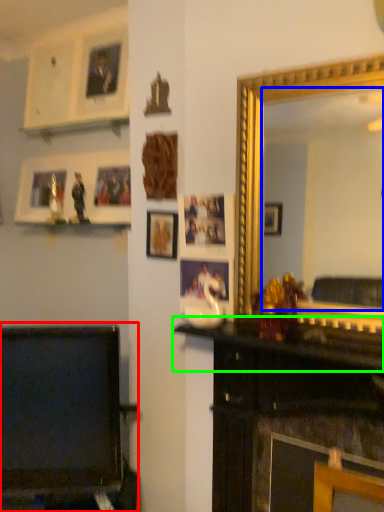
Question: Considering the real-world distances, which object is closest to furniture (highlighted by a red box)? mirror (highlighted by a blue box) or mantle (highlighted by a green box).

Choices:
 (A) mirror
 (B) mantle

Answer: (B)